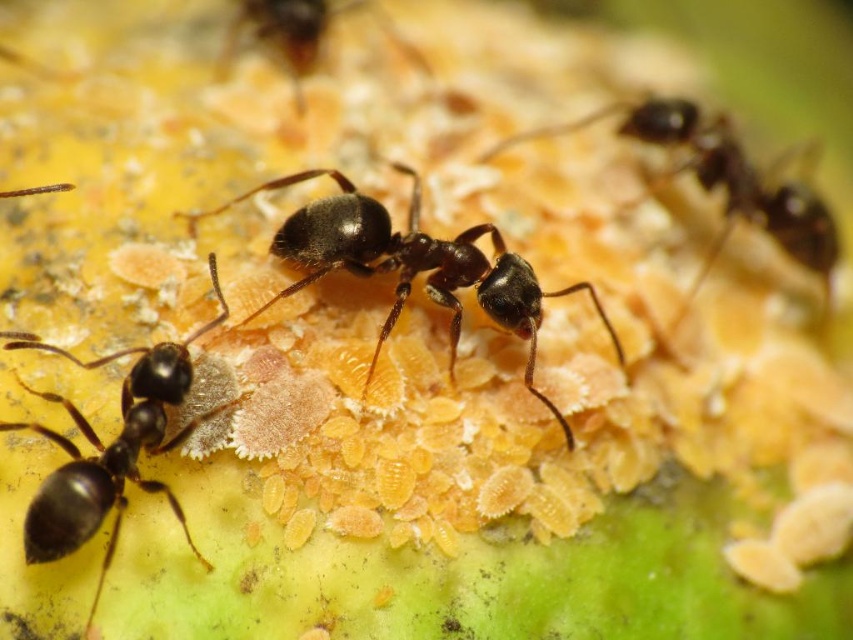
Which of these two, shiny black ant at center or black glossy ant at lower left, stands taller?

With more height is black glossy ant at lower left.

Is shiny black ant at center thinner than black glossy ant at lower left?

Incorrect, shiny black ant at center's width is not less than black glossy ant at lower left's.

Which is in front, point (438, 275) or point (149, 416)?

Point (149, 416)

Locate an element on the screen. shiny black ant at center is located at coordinates (412, 264).

Between black glossy ant at lower left and shiny brown ant at upper center, which one appears on the right side from the viewer's perspective?

shiny brown ant at upper center

Does black glossy ant at lower left have a greater width compared to shiny brown ant at upper center?

Incorrect, black glossy ant at lower left's width does not surpass shiny brown ant at upper center's.

Find the location of `black glossy ant at lower left`. black glossy ant at lower left is located at coordinates (112, 451).

In the scene shown: Is black glossy ant at lower left below black glossy ant at center?

Indeed, black glossy ant at lower left is positioned under black glossy ant at center.

Can you confirm if black glossy ant at lower left is smaller than black glossy ant at center?

Indeed, black glossy ant at lower left has a smaller size compared to black glossy ant at center.

Locate an element on the screen. The height and width of the screenshot is (640, 853). black glossy ant at lower left is located at coordinates (112, 451).